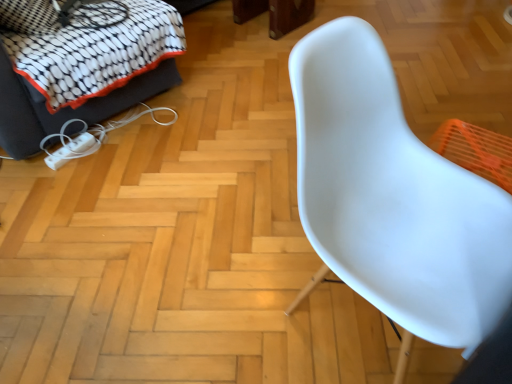
Describe the element at coordinates (85, 68) in the screenshot. I see `white fabric sofa at upper left` at that location.

Where is `white fabric sofa at upper left`? The image size is (512, 384). white fabric sofa at upper left is located at coordinates (85, 68).

Locate an element on the screen. The image size is (512, 384). white plastic chair at right is located at coordinates (392, 198).

Describe the element at coordinates (392, 198) in the screenshot. This screenshot has width=512, height=384. I see `white plastic chair at right` at that location.

Find the location of a particular element. white fabric sofa at upper left is located at coordinates (85, 68).

Between white fabric sofa at upper left and white plastic chair at right, which one appears on the right side from the viewer's perspective?

From the viewer's perspective, white plastic chair at right appears more on the right side.

Is white fabric sofa at upper left behind white plastic chair at right?

Yes.

Which is more distant, (142, 98) or (347, 170)?

The point (142, 98) is farther.

From the image's perspective, relative to white plastic chair at right, is white fabric sofa at upper left above or below?

white fabric sofa at upper left is above white plastic chair at right.

From a real-world perspective, does white fabric sofa at upper left stand above white plastic chair at right?

No.

Is white fabric sofa at upper left wider than white plastic chair at right?

Yes, white fabric sofa at upper left is wider than white plastic chair at right.

Is white fabric sofa at upper left shorter than white plastic chair at right?

Indeed, white fabric sofa at upper left has a lesser height compared to white plastic chair at right.

Considering the relative sizes of white fabric sofa at upper left and white plastic chair at right in the image provided, is white fabric sofa at upper left smaller than white plastic chair at right?

No, white fabric sofa at upper left is not smaller than white plastic chair at right.

Does white fabric sofa at upper left contain white plastic chair at right?

No, white plastic chair at right is located outside of white fabric sofa at upper left.

Is there a large distance between white fabric sofa at upper left and white plastic chair at right?

white fabric sofa at upper left is far away from white plastic chair at right.

Is white fabric sofa at upper left positioned with its back to white plastic chair at right?

No.

How different are the orientations of white fabric sofa at upper left and white plastic chair at right in degrees?

The angle between the facing direction of white fabric sofa at upper left and the facing direction of white plastic chair at right is 90.6 degrees.

In the scene shown: How distant is white fabric sofa at upper left from white plastic chair at right?

white fabric sofa at upper left is 4.09 feet from white plastic chair at right.

I want to click on chair in front of the white fabric sofa at upper left, so [x=392, y=198].

Which is more to the left, white plastic chair at right or white fabric sofa at upper left?

From the viewer's perspective, white fabric sofa at upper left appears more on the left side.

In the image, is white plastic chair at right positioned in front of or behind white fabric sofa at upper left?

white plastic chair at right is in front of white fabric sofa at upper left.

Which point is more distant from viewer, (362, 122) or (135, 2)?

The point (135, 2) is farther from the camera.

Based on the photo, from the image's perspective, which object appears higher, white plastic chair at right or white fabric sofa at upper left?

white fabric sofa at upper left.

From a real-world perspective, is white plastic chair at right physically above white fabric sofa at upper left?

Yes, from a real-world perspective, white plastic chair at right is above white fabric sofa at upper left.

Considering the relative sizes of white plastic chair at right and white fabric sofa at upper left in the image provided, is white plastic chair at right wider than white fabric sofa at upper left?

No.

Does white plastic chair at right have a lesser height compared to white fabric sofa at upper left?

No, white plastic chair at right is not shorter than white fabric sofa at upper left.

Looking at the image, does white plastic chair at right seem bigger or smaller compared to white fabric sofa at upper left?

Clearly, white plastic chair at right is smaller in size than white fabric sofa at upper left.

Is white plastic chair at right not within white fabric sofa at upper left?

white plastic chair at right lies outside white fabric sofa at upper left's area.

Is white plastic chair at right not close to white fabric sofa at upper left?

Absolutely, white plastic chair at right is distant from white fabric sofa at upper left.

Is white plastic chair at right facing towards white fabric sofa at upper left?

No, white plastic chair at right is not aimed at white fabric sofa at upper left.

What's the angular difference between white plastic chair at right and white fabric sofa at upper left's facing directions?

white plastic chair at right and white fabric sofa at upper left are facing 90.6 degrees away from each other.

The image size is (512, 384). Identify the location of furniture below the white plastic chair at right (from a real-world perspective). (85, 68).

In order to click on furniture behind the white plastic chair at right in this screenshot , I will do `click(85, 68)`.

Locate an element on the screen. The width and height of the screenshot is (512, 384). chair in front of the white fabric sofa at upper left is located at coordinates 392,198.